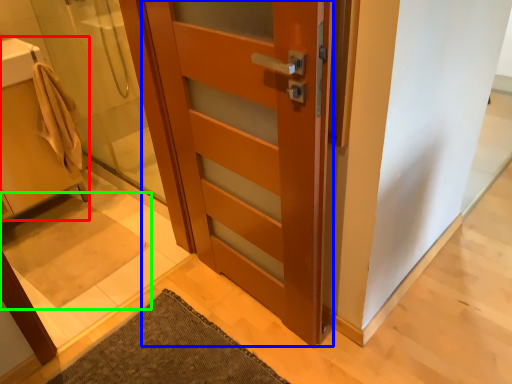
Question: Which object is positioned farthest from sink (highlighted by a red box)? Select from door (highlighted by a blue box) and bath mat (highlighted by a green box).

Choices:
 (A) door
 (B) bath mat

Answer: (A)